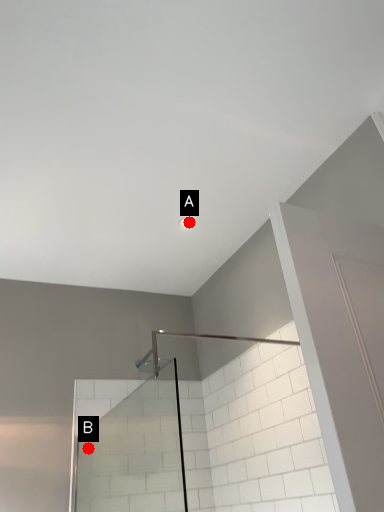
Question: Two points are circled on the image, labeled by A and B beside each circle. Which point is closer to the camera?

Choices:
 (A) A is closer
 (B) B is closer

Answer: (A)